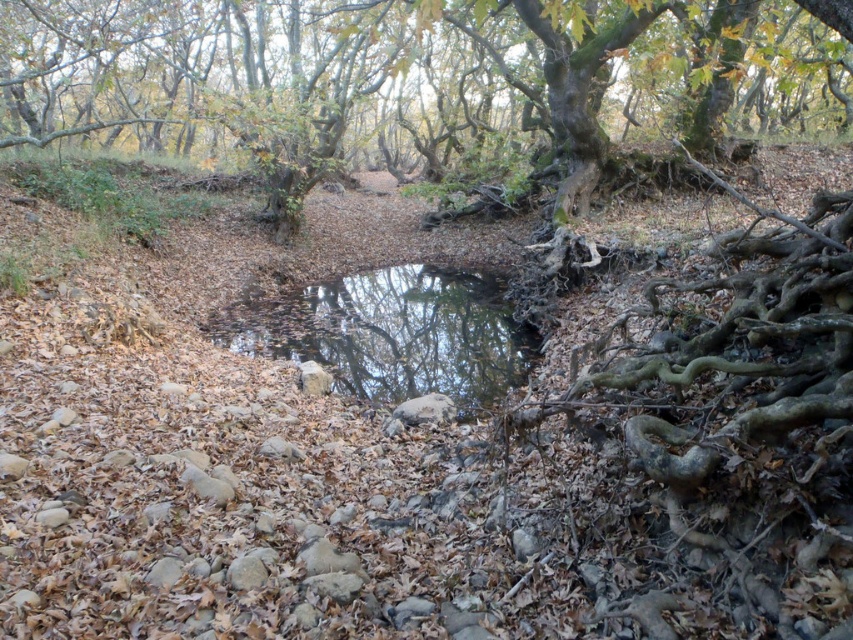
Question: Which point is closer to the camera taking this photo?

Choices:
 (A) (555, 102)
 (B) (496, 310)

Answer: (B)

Question: Can you confirm if green mossy tree at center is positioned to the left of clear water at center?

Choices:
 (A) yes
 (B) no

Answer: (A)

Question: Is green mossy tree at center thinner than clear water at center?

Choices:
 (A) yes
 (B) no

Answer: (B)

Question: Which object is closer to the camera taking this photo?

Choices:
 (A) green mossy tree at center
 (B) clear water at center

Answer: (A)

Question: Considering the relative positions of green mossy tree at center and clear water at center in the image provided, where is green mossy tree at center located with respect to clear water at center?

Choices:
 (A) below
 (B) above

Answer: (B)